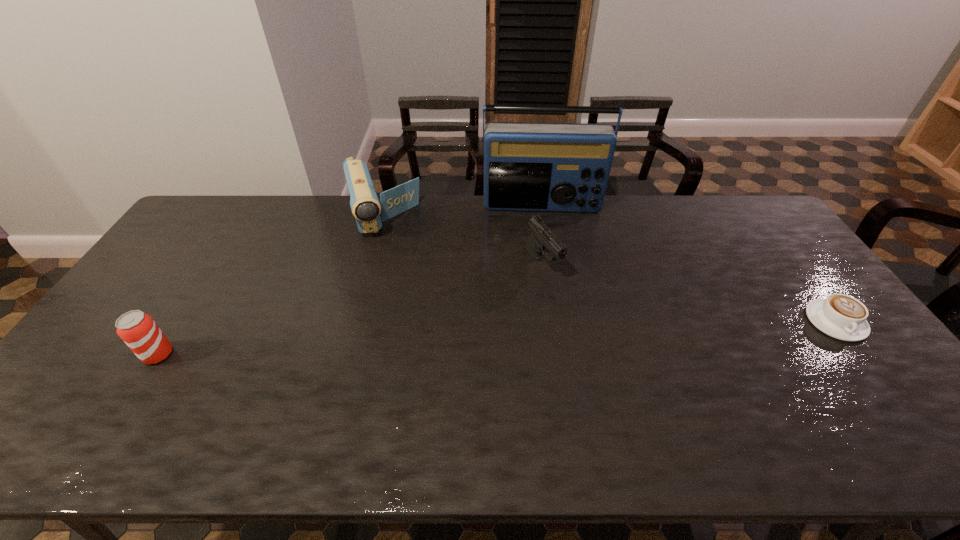
Locate an element on the screen. free space on the desktop that is between the beer can and the rightmost object and is positioned on the front panel of the tallest object is located at coordinates (555, 335).

Locate an element on the screen. This screenshot has width=960, height=540. vacant spot on the desktop that is between the beer can and the cappuccino and is positioned on the side of the second object from left to right with the flip-out screen is located at coordinates (419, 342).

This screenshot has height=540, width=960. I want to click on free space on the desktop that is between the leftmost object and the rightmost object and is positioned at the barrel of the pistol, so click(x=597, y=333).